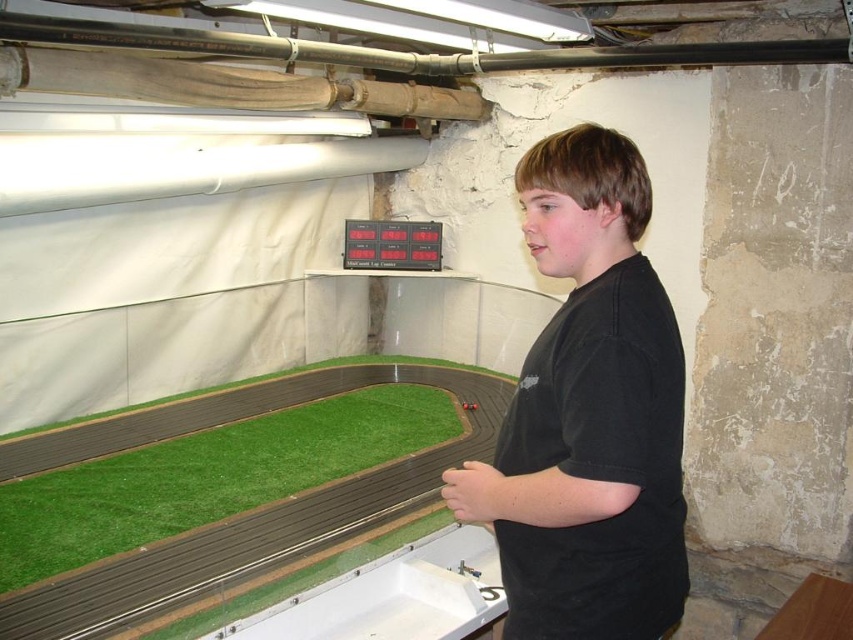
Question: Which point is farther to the camera?

Choices:
 (A) black matte shirt at center
 (B) green artificial turf at lower left

Answer: (B)

Question: Can you confirm if black matte shirt at center is positioned below green artificial turf at lower left?

Choices:
 (A) yes
 (B) no

Answer: (B)

Question: Does black matte shirt at center lie in front of green artificial turf at lower left?

Choices:
 (A) yes
 (B) no

Answer: (A)

Question: Which point is closer to the camera?

Choices:
 (A) green artificial turf at lower left
 (B) black matte shirt at center

Answer: (B)

Question: Which object appears closest to the camera in this image?

Choices:
 (A) green artificial turf at lower left
 (B) black matte shirt at center

Answer: (B)

Question: Does black matte shirt at center appear over green artificial turf at lower left?

Choices:
 (A) yes
 (B) no

Answer: (A)